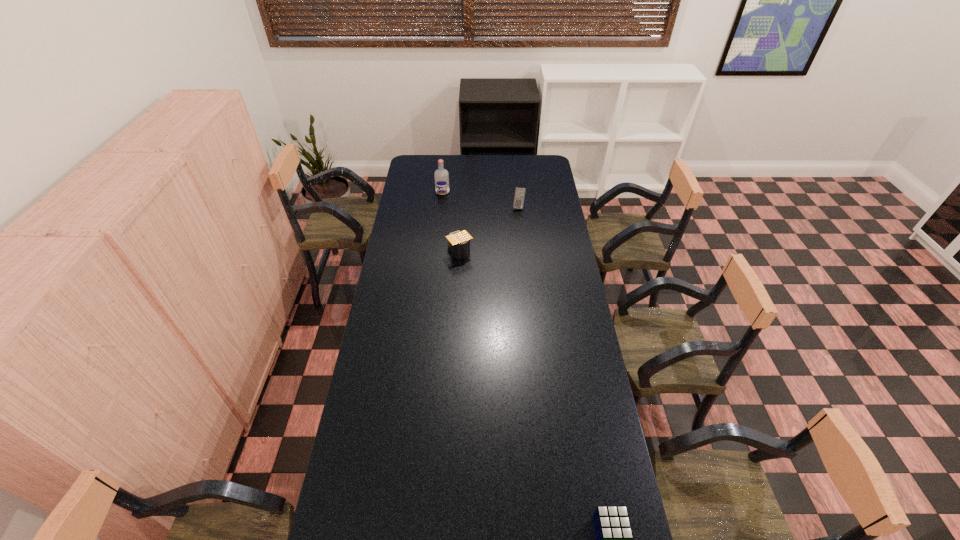
Find the location of `the leftmost object`. the leftmost object is located at coordinates (441, 175).

Find the location of `vodka`. vodka is located at coordinates (441, 175).

In order to click on the right calculator in this screenshot , I will do `click(519, 195)`.

This screenshot has width=960, height=540. Identify the location of the farther calculator. (519, 195).

Locate an element on the screen. the left calculator is located at coordinates (458, 242).

At what (x,y) coordinates should I click in order to perform the action: click on the third farthest object. Please return your answer as a coordinate pair (x, y). This screenshot has width=960, height=540. Looking at the image, I should click on (458, 242).

The height and width of the screenshot is (540, 960). I want to click on vacant space located 0.100m on the label of the farthest object, so click(x=442, y=206).

In order to click on vacant space situated on the front-facing side of the second farthest object in this screenshot , I will do `click(523, 256)`.

This screenshot has width=960, height=540. In order to click on blank space located 0.190m on the left of the second nearest object in this screenshot , I will do `click(407, 252)`.

Identify the location of vacant space at the far edge of the desktop. This screenshot has width=960, height=540. (461, 175).